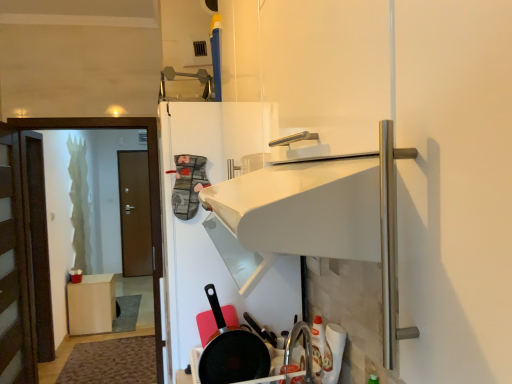
Locate an element on the screen. free space in front of matte wood cabinet at lower left is located at coordinates point(83,335).